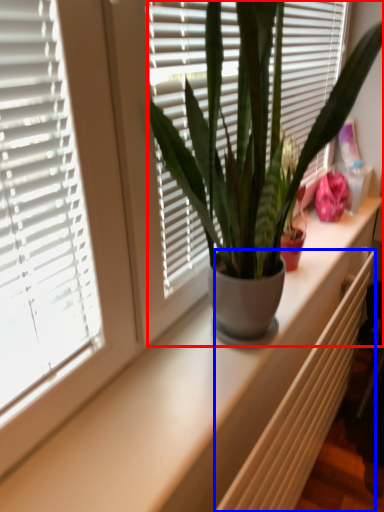
Question: Among these objects, which one is nearest to the camera, houseplant (highlighted by a red box) or radiator (highlighted by a blue box)?

Choices:
 (A) houseplant
 (B) radiator

Answer: (A)